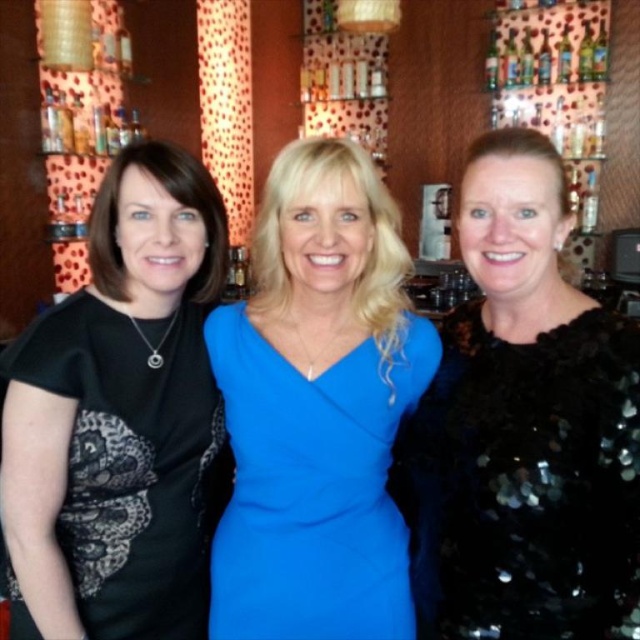
Question: Estimate the real-world distances between objects in this image. Which object is closer to the royal blue fabric dress at center?

Choices:
 (A) black matte shirt at left
 (B) black sequined dress at right

Answer: (B)

Question: Which point appears farthest from the camera in this image?

Choices:
 (A) (120, 547)
 (B) (262, 532)
 (C) (540, 260)

Answer: (A)

Question: From the image, what is the correct spatial relationship of black sequined dress at right in relation to royal blue fabric dress at center?

Choices:
 (A) left
 (B) right

Answer: (B)

Question: Is black sequined dress at right to the right of black matte shirt at left from the viewer's perspective?

Choices:
 (A) no
 (B) yes

Answer: (B)

Question: Can you confirm if black matte shirt at left is bigger than royal blue fabric dress at center?

Choices:
 (A) no
 (B) yes

Answer: (B)

Question: Estimate the real-world distances between objects in this image. Which object is farther from the black sequined dress at right?

Choices:
 (A) royal blue fabric dress at center
 (B) black matte shirt at left

Answer: (B)